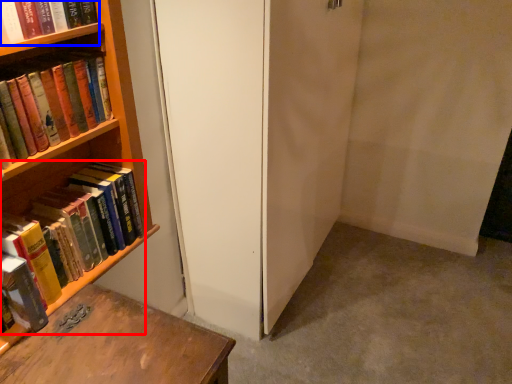
Question: Which point is further to the camera, book (highlighted by a red box) or book (highlighted by a blue box)?

Choices:
 (A) book
 (B) book

Answer: (A)